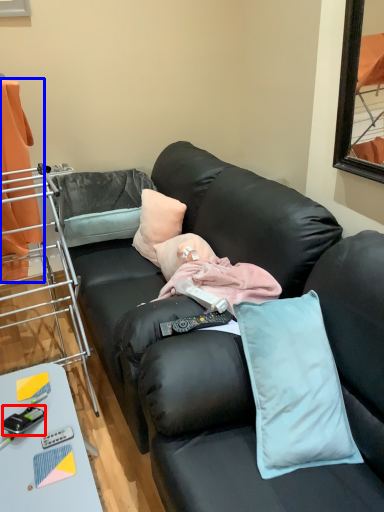
Question: Which point is further to the camera, equipment (highlighted by a red box) or curtain (highlighted by a blue box)?

Choices:
 (A) equipment
 (B) curtain

Answer: (B)